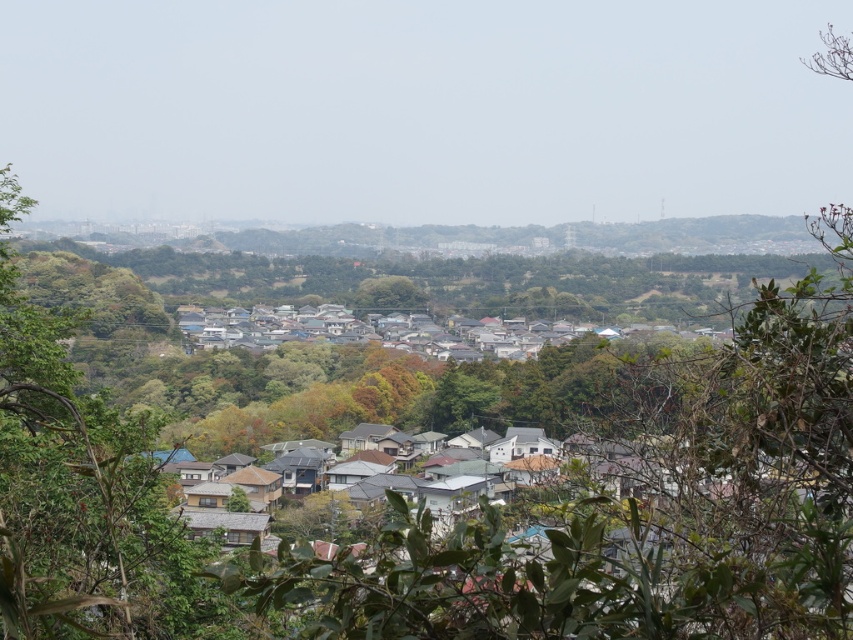
What do you see at coordinates (80, 499) in the screenshot?
I see `green leafy tree at left` at bounding box center [80, 499].

Does green leafy tree at left appear on the left side of green leafy tree at center?

In fact, green leafy tree at left is to the right of green leafy tree at center.

Find the location of a particular element. The width and height of the screenshot is (853, 640). green leafy tree at left is located at coordinates (80, 499).